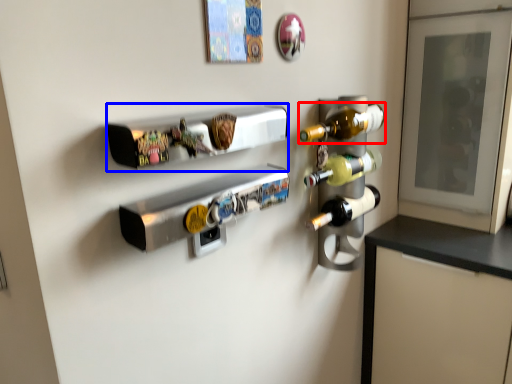
Question: Which point is closer to the camera, bottle (highlighted by a red box) or shelf (highlighted by a blue box)?

Choices:
 (A) bottle
 (B) shelf

Answer: (B)